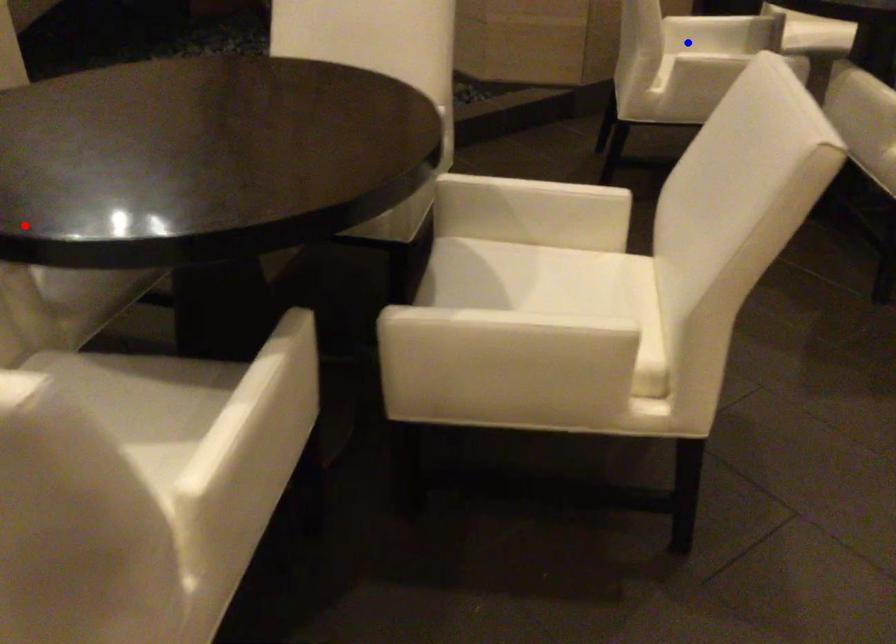
Question: In the image, two points are highlighted. Which point is nearer to the camera? Reply with the corresponding letter.

Choices:
 (A) blue point
 (B) red point

Answer: (B)